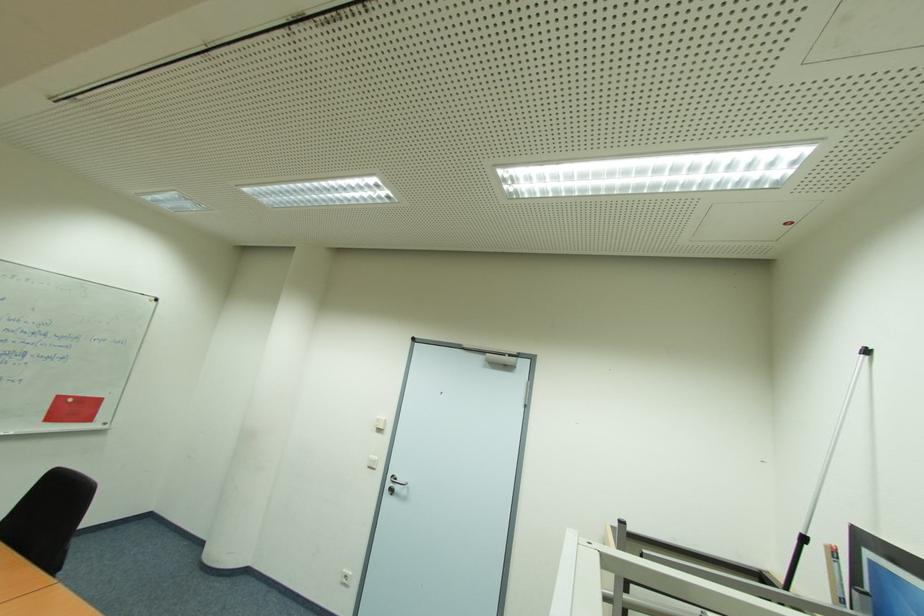
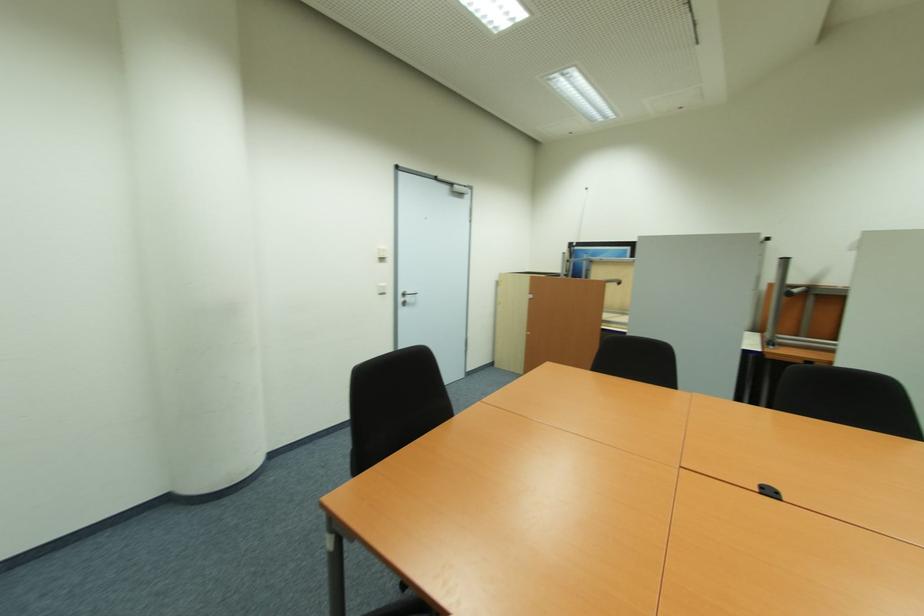
The point at (392,485) is marked in the first image. Where is the corresponding point in the second image?

(405, 300)